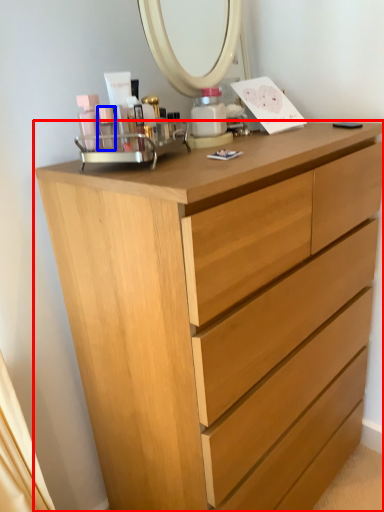
Question: Which of the following is the farthest to the observer, chest of drawers (highlighted by a red box) or toiletry (highlighted by a blue box)?

Choices:
 (A) chest of drawers
 (B) toiletry

Answer: (B)